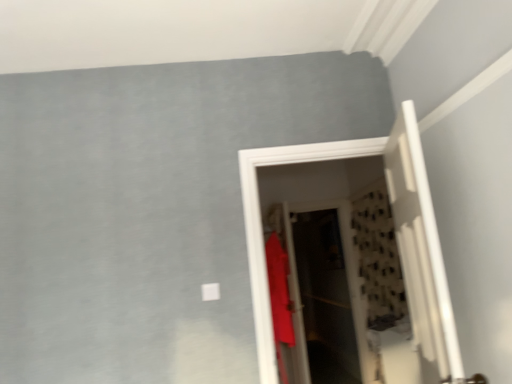
Question: From the image's perspective, is translucent plastic screen door at center over matte white door at center, the second door positioned from the front?

Choices:
 (A) yes
 (B) no

Answer: (B)

Question: Can you confirm if translucent plastic screen door at center is wider than matte white door at center, the second door positioned from the front?

Choices:
 (A) no
 (B) yes

Answer: (A)

Question: Can you confirm if translucent plastic screen door at center is taller than matte white door at center, the second door positioned from the front?

Choices:
 (A) yes
 (B) no

Answer: (A)

Question: Is translucent plastic screen door at center to the right of matte white door at center, marked as the first door in a back-to-front arrangement, from the viewer's perspective?

Choices:
 (A) yes
 (B) no

Answer: (A)

Question: Does translucent plastic screen door at center turn towards matte white door at center, marked as the first door in a back-to-front arrangement?

Choices:
 (A) yes
 (B) no

Answer: (A)

Question: From a real-world perspective, is white wooden door at right, the 2th door viewed from the back, positioned above or below matte white door at center, the second door positioned from the front?

Choices:
 (A) below
 (B) above

Answer: (A)

Question: Considering the positions of point (421, 256) and point (318, 152), is point (421, 256) closer or farther from the camera than point (318, 152)?

Choices:
 (A) farther
 (B) closer

Answer: (B)

Question: Considering the positions of white wooden door at right, the 2th door viewed from the back, and matte white door at center, the second door positioned from the front, in the image, is white wooden door at right, the 2th door viewed from the back, taller or shorter than matte white door at center, the second door positioned from the front,?

Choices:
 (A) tall
 (B) short

Answer: (B)

Question: In the image, is white wooden door at right, the 2th door viewed from the back, positioned in front of or behind matte white door at center, marked as the first door in a back-to-front arrangement?

Choices:
 (A) behind
 (B) front

Answer: (B)

Question: Is matte white door at center, the second door positioned from the front, bigger or smaller than matte red shirt at center?

Choices:
 (A) small
 (B) big

Answer: (A)

Question: From a real-world perspective, is matte white door at center, the second door positioned from the front, physically located above or below matte red shirt at center?

Choices:
 (A) below
 (B) above

Answer: (B)

Question: Would you say matte white door at center, marked as the first door in a back-to-front arrangement, is to the left or to the right of matte red shirt at center in the picture?

Choices:
 (A) left
 (B) right

Answer: (B)

Question: From their relative heights in the image, would you say matte white door at center, marked as the first door in a back-to-front arrangement, is taller or shorter than matte red shirt at center?

Choices:
 (A) short
 (B) tall

Answer: (A)

Question: Is matte red shirt at center wider or thinner than white wooden door at right, positioned as the first door in front-to-back order?

Choices:
 (A) thin
 (B) wide

Answer: (B)

Question: In terms of height, does matte red shirt at center look taller or shorter compared to white wooden door at right, positioned as the first door in front-to-back order?

Choices:
 (A) short
 (B) tall

Answer: (B)